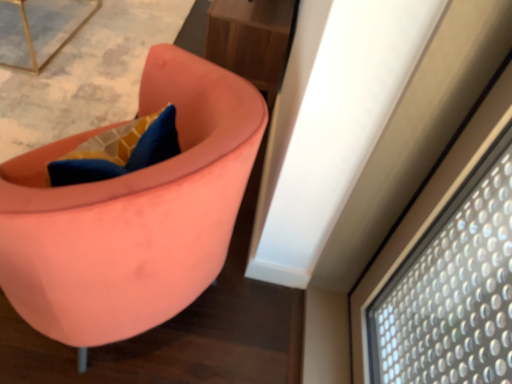
Locate an element on the screen. Image resolution: width=512 pixels, height=384 pixels. metallic gold table at upper left is located at coordinates (39, 29).

What do you see at coordinates (252, 40) in the screenshot? Image resolution: width=512 pixels, height=384 pixels. I see `wooden table at upper center` at bounding box center [252, 40].

What are the coordinates of `matte pink chair at center` in the screenshot? It's located at (132, 213).

From a real-world perspective, does wooden table at upper center stand above matte pink chair at center?

Correct, in the physical world, wooden table at upper center is higher than matte pink chair at center.

Is point (243, 35) closer or farther from the camera than point (98, 218)?

Point (243, 35) appears to be farther away from the viewer than point (98, 218).

Can you confirm if wooden table at upper center is wider than matte pink chair at center?

No, wooden table at upper center is not wider than matte pink chair at center.

Is wooden table at upper center at the right side of matte pink chair at center?

Indeed, wooden table at upper center is positioned on the right side of matte pink chair at center.

Is wooden table at upper center at the back of matte pink chair at center?

matte pink chair at center is not turned away from wooden table at upper center.

Considering the positions of objects matte pink chair at center and wooden table at upper center in the image provided, who is more to the right, matte pink chair at center or wooden table at upper center?

From the viewer's perspective, wooden table at upper center appears more on the right side.

Between matte pink chair at center and wooden table at upper center, which one has less height?

With less height is matte pink chair at center.

Is point (48, 199) positioned before point (269, 63)?

Yes.

Consider the image. From the image's perspective, is metallic gold table at upper left on top of wooden table at upper center?

Yes, from the image's perspective, metallic gold table at upper left is over wooden table at upper center.

Is metallic gold table at upper left inside or outside of wooden table at upper center?

metallic gold table at upper left is located beyond the bounds of wooden table at upper center.

Is point (3, 31) closer to viewer compared to point (289, 43)?

No.

Between point (88, 18) and point (222, 232), which one is positioned in front?

The point (222, 232) is in front.

From a real-world perspective, is metallic gold table at upper left physically located above or below matte pink chair at center?

In terms of real-world spatial position, metallic gold table at upper left is above matte pink chair at center.

Which object is further away from the camera taking this photo, metallic gold table at upper left or matte pink chair at center?

Positioned behind is metallic gold table at upper left.

Is metallic gold table at upper left inside the boundaries of matte pink chair at center, or outside?

metallic gold table at upper left cannot be found inside matte pink chair at center.

Can you tell me how much wooden table at upper center and metallic gold table at upper left differ in facing direction?

179 degrees.

In the image, is wooden table at upper center positioned in front of or behind metallic gold table at upper left?

Visually, wooden table at upper center is located behind metallic gold table at upper left.

Which of these two, wooden table at upper center or metallic gold table at upper left, is smaller?

metallic gold table at upper left.

Considering the relative sizes of wooden table at upper center and metallic gold table at upper left in the image provided, is wooden table at upper center thinner than metallic gold table at upper left?

Correct, the width of wooden table at upper center is less than that of metallic gold table at upper left.

Where is `chair to the right of metallic gold table at upper left`? The image size is (512, 384). chair to the right of metallic gold table at upper left is located at coordinates (132, 213).

Looking at the image, does matte pink chair at center seem bigger or smaller compared to metallic gold table at upper left?

In the image, matte pink chair at center appears to be larger than metallic gold table at upper left.

Is matte pink chair at center to the right of metallic gold table at upper left from the viewer's perspective?

Yes.

How distant is matte pink chair at center from metallic gold table at upper left?

The distance of matte pink chair at center from metallic gold table at upper left is 5.30 feet.

In order to click on chair on the left of wooden table at upper center in this screenshot , I will do `click(132, 213)`.

There is a matte pink chair at center. What are the coordinates of `table above it (from a real-world perspective)` in the screenshot? It's located at (252, 40).

Based on the photo, estimate the real-world distances between objects in this image. Which object is further from metallic gold table at upper left, wooden table at upper center or matte pink chair at center?

matte pink chair at center lies further to metallic gold table at upper left than the other object.

From the picture: From the image, which object appears to be farther from metallic gold table at upper left, matte pink chair at center or wooden table at upper center?

matte pink chair at center is positioned further to the anchor metallic gold table at upper left.

From the image, which object appears to be nearer to wooden table at upper center, metallic gold table at upper left or matte pink chair at center?

The object closer to wooden table at upper center is metallic gold table at upper left.

Based on their spatial positions, is matte pink chair at center or metallic gold table at upper left further from wooden table at upper center?

matte pink chair at center lies further to wooden table at upper center than the other object.

Based on their spatial positions, is wooden table at upper center or metallic gold table at upper left closer to matte pink chair at center?

wooden table at upper center.

When comparing their distances from matte pink chair at center, does metallic gold table at upper left or wooden table at upper center seem closer?

Based on the image, wooden table at upper center appears to be nearer to matte pink chair at center.

This screenshot has height=384, width=512. I want to click on chair between metallic gold table at upper left and wooden table at upper center, so click(132, 213).